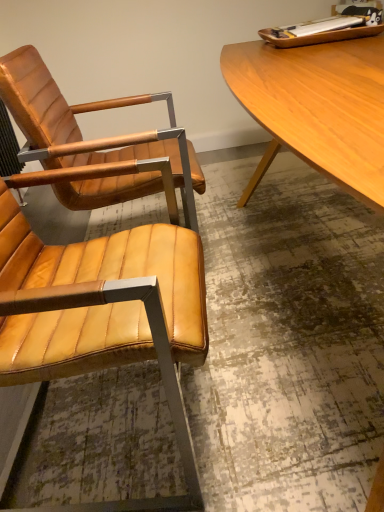
How much space does matte leather chair at left, placed as the second chair when sorted from back to front, occupy vertically?

matte leather chair at left, placed as the second chair when sorted from back to front, is 87.04 centimeters tall.

Where is `matte leather chair at left, positioned as the first chair in front-to-back order`? matte leather chair at left, positioned as the first chair in front-to-back order is located at coordinates (104, 315).

Where is `light brown wood desk at upper right`? The image size is (384, 512). light brown wood desk at upper right is located at coordinates (317, 108).

Describe the element at coordinates (317, 108) in the screenshot. The height and width of the screenshot is (512, 384). I see `light brown wood desk at upper right` at that location.

The image size is (384, 512). I want to click on matte leather chair at left, the 1th chair positioned from the back, so click(80, 131).

At what (x,y) coordinates should I click in order to perform the action: click on the 1st chair above the light brown wood desk at upper right (from a real-world perspective). Please return your answer as a coordinate pair (x, y). Image resolution: width=384 pixels, height=512 pixels. Looking at the image, I should click on [104, 315].

From their relative heights in the image, would you say light brown wood desk at upper right is taller or shorter than matte leather chair at left, positioned as the first chair in front-to-back order?

Considering their sizes, light brown wood desk at upper right has less height than matte leather chair at left, positioned as the first chair in front-to-back order.

From the picture: Is matte leather chair at left, positioned as the first chair in front-to-back order, a part of light brown wood desk at upper right?

No, matte leather chair at left, positioned as the first chair in front-to-back order, is located outside of light brown wood desk at upper right.

From the image's perspective, is matte leather chair at left, the 1th chair positioned from the back, on top of matte leather chair at left, placed as the second chair when sorted from back to front?

Yes, from the image's perspective, matte leather chair at left, the 1th chair positioned from the back, is on top of matte leather chair at left, placed as the second chair when sorted from back to front.

Which is correct: matte leather chair at left, the 1th chair positioned from the back, is inside matte leather chair at left, placed as the second chair when sorted from back to front, or outside of it?

matte leather chair at left, the 1th chair positioned from the back, is spatially situated outside matte leather chair at left, placed as the second chair when sorted from back to front.

In the image, is matte leather chair at left, the 1th chair positioned from the back, on the left side or the right side of matte leather chair at left, positioned as the first chair in front-to-back order?

Clearly, matte leather chair at left, the 1th chair positioned from the back, is on the right of matte leather chair at left, positioned as the first chair in front-to-back order, in the image.

Does matte leather chair at left, the 1th chair positioned from the back, lie behind matte leather chair at left, placed as the second chair when sorted from back to front?

Yes, the depth of matte leather chair at left, the 1th chair positioned from the back, is greater than that of matte leather chair at left, placed as the second chair when sorted from back to front.

From the image's perspective, is matte leather chair at left, the 2th chair in the front-to-back sequence, located beneath light brown wood desk at upper right?

No, from the image's perspective, matte leather chair at left, the 2th chair in the front-to-back sequence, is not below light brown wood desk at upper right.

Can you tell me how much matte leather chair at left, the 2th chair in the front-to-back sequence, and light brown wood desk at upper right differ in facing direction?

They differ by 1.28 degrees in their facing directions.

From a real-world perspective, is matte leather chair at left, the 1th chair positioned from the back, on top of light brown wood desk at upper right?

Yes, from a real-world perspective, matte leather chair at left, the 1th chair positioned from the back, is over light brown wood desk at upper right

The height and width of the screenshot is (512, 384). What are the coordinates of `chair above the light brown wood desk at upper right (from the image's perspective)` in the screenshot? It's located at (80, 131).

Is light brown wood desk at upper right shorter than matte leather chair at left, the 1th chair positioned from the back?

Yes, light brown wood desk at upper right is shorter than matte leather chair at left, the 1th chair positioned from the back.

Which is behind, point (293, 106) or point (19, 64)?

Point (19, 64)

From a real-world perspective, which object stands above the other?

matte leather chair at left, the 1th chair positioned from the back, from a real-world perspective.

Based on the photo, are matte leather chair at left, placed as the second chair when sorted from back to front, and matte leather chair at left, the 2th chair in the front-to-back sequence, beside each other?

They are not placed beside each other.

Can you tell me how much matte leather chair at left, placed as the second chair when sorted from back to front, and matte leather chair at left, the 1th chair positioned from the back, differ in facing direction?

4.02 degrees separate the facing orientations of matte leather chair at left, placed as the second chair when sorted from back to front, and matte leather chair at left, the 1th chair positioned from the back.

From a real-world perspective, is matte leather chair at left, placed as the second chair when sorted from back to front, above or below matte leather chair at left, the 2th chair in the front-to-back sequence?

matte leather chair at left, placed as the second chair when sorted from back to front, is situated lower than matte leather chair at left, the 2th chair in the front-to-back sequence, in the real world.

Between point (161, 231) and point (146, 159), which one is positioned in front?

The point (161, 231) is more forward.

From the image's perspective, between matte leather chair at left, placed as the second chair when sorted from back to front, and light brown wood desk at upper right, who is located below?

matte leather chair at left, placed as the second chair when sorted from back to front, is shown below in the image.

Does matte leather chair at left, placed as the second chair when sorted from back to front, come behind light brown wood desk at upper right?

Yes, it is.

The image size is (384, 512). I want to click on desk above the matte leather chair at left, positioned as the first chair in front-to-back order (from the image's perspective), so click(317, 108).

This screenshot has width=384, height=512. I want to click on chair behind the matte leather chair at left, positioned as the first chair in front-to-back order, so click(x=80, y=131).

Looking at the image, which one is located closer to matte leather chair at left, the 2th chair in the front-to-back sequence, matte leather chair at left, placed as the second chair when sorted from back to front, or light brown wood desk at upper right?

Based on the image, matte leather chair at left, placed as the second chair when sorted from back to front, appears to be nearer to matte leather chair at left, the 2th chair in the front-to-back sequence.

Based on their spatial positions, is light brown wood desk at upper right or matte leather chair at left, the 1th chair positioned from the back, closer to matte leather chair at left, positioned as the first chair in front-to-back order?

Among the two, matte leather chair at left, the 1th chair positioned from the back, is located nearer to matte leather chair at left, positioned as the first chair in front-to-back order.

Considering their positions, is matte leather chair at left, the 1th chair positioned from the back, positioned further to light brown wood desk at upper right than matte leather chair at left, positioned as the first chair in front-to-back order?

Based on the image, matte leather chair at left, positioned as the first chair in front-to-back order, appears to be further to light brown wood desk at upper right.

Estimate the real-world distances between objects in this image. Which object is closer to matte leather chair at left, the 2th chair in the front-to-back sequence, light brown wood desk at upper right or matte leather chair at left, positioned as the first chair in front-to-back order?

Based on the image, matte leather chair at left, positioned as the first chair in front-to-back order, appears to be nearer to matte leather chair at left, the 2th chair in the front-to-back sequence.

Which object lies further to the anchor point matte leather chair at left, placed as the second chair when sorted from back to front, matte leather chair at left, the 1th chair positioned from the back, or light brown wood desk at upper right?

The object further to matte leather chair at left, placed as the second chair when sorted from back to front, is light brown wood desk at upper right.

Based on their spatial positions, is matte leather chair at left, positioned as the first chair in front-to-back order, or matte leather chair at left, the 2th chair in the front-to-back sequence, closer to light brown wood desk at upper right?

matte leather chair at left, the 2th chair in the front-to-back sequence.

Find the location of `chair between matte leather chair at left, placed as the second chair when sorted from back to front, and light brown wood desk at upper right, in the horizontal direction`. chair between matte leather chair at left, placed as the second chair when sorted from back to front, and light brown wood desk at upper right, in the horizontal direction is located at coordinates (80, 131).